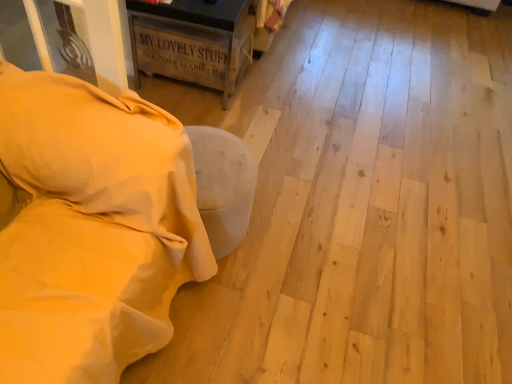
Question: Considering the relative sizes of beige fabric ottoman at lower left, which ranks as the second furniture in top-to-bottom order, and rustic wood crate at upper left, which is the first furniture from top to bottom, in the image provided, is beige fabric ottoman at lower left, which ranks as the second furniture in top-to-bottom order, shorter than rustic wood crate at upper left, which is the first furniture from top to bottom,?

Choices:
 (A) no
 (B) yes

Answer: (A)

Question: From the image's perspective, would you say beige fabric ottoman at lower left, the second furniture when ordered from back to front, is shown under rustic wood crate at upper left, which is counted as the 2th furniture, starting from the front?

Choices:
 (A) no
 (B) yes

Answer: (B)

Question: Is the position of beige fabric ottoman at lower left, positioned as the 1th furniture in bottom-to-top order, more distant than that of rustic wood crate at upper left, which is the first furniture from top to bottom?

Choices:
 (A) no
 (B) yes

Answer: (A)

Question: Does beige fabric ottoman at lower left, positioned as the 1th furniture in bottom-to-top order, appear on the left side of rustic wood crate at upper left, which is counted as the first furniture, starting from the back?

Choices:
 (A) yes
 (B) no

Answer: (A)

Question: From a real-world perspective, does beige fabric ottoman at lower left, the first furniture in the front-to-back sequence, stand above rustic wood crate at upper left, which is counted as the 2th furniture, starting from the front?

Choices:
 (A) yes
 (B) no

Answer: (A)

Question: Considering the positions of beige fabric ottoman at lower left, the second furniture when ordered from back to front, and beige soft pillow at left in the image, is beige fabric ottoman at lower left, the second furniture when ordered from back to front, wider or thinner than beige soft pillow at left?

Choices:
 (A) wide
 (B) thin

Answer: (A)

Question: Is beige fabric ottoman at lower left, positioned as the 1th furniture in bottom-to-top order, situated inside beige soft pillow at left or outside?

Choices:
 (A) outside
 (B) inside

Answer: (A)

Question: From their relative heights in the image, would you say beige fabric ottoman at lower left, which ranks as the second furniture in top-to-bottom order, is taller or shorter than beige soft pillow at left?

Choices:
 (A) tall
 (B) short

Answer: (A)

Question: From a real-world perspective, is beige fabric ottoman at lower left, which ranks as the second furniture in top-to-bottom order, above or below beige soft pillow at left?

Choices:
 (A) above
 (B) below

Answer: (B)

Question: From their relative heights in the image, would you say rustic wood crate at upper left, which is the first furniture from top to bottom, is taller or shorter than beige fabric ottoman at lower left, which ranks as the second furniture in top-to-bottom order?

Choices:
 (A) tall
 (B) short

Answer: (B)

Question: Is rustic wood crate at upper left, which is counted as the first furniture, starting from the back, spatially inside beige fabric ottoman at lower left, which ranks as the second furniture in top-to-bottom order, or outside of it?

Choices:
 (A) outside
 (B) inside

Answer: (A)

Question: From a real-world perspective, relative to beige fabric ottoman at lower left, positioned as the 1th furniture in bottom-to-top order, is rustic wood crate at upper left, which is the first furniture from top to bottom, vertically above or below?

Choices:
 (A) above
 (B) below

Answer: (B)

Question: Based on their sizes in the image, would you say rustic wood crate at upper left, which is the 2th furniture from bottom to top, is bigger or smaller than beige fabric ottoman at lower left, the first furniture in the front-to-back sequence?

Choices:
 (A) big
 (B) small

Answer: (B)

Question: In terms of size, does beige soft pillow at left appear bigger or smaller than beige fabric ottoman at lower left, the second furniture when ordered from back to front?

Choices:
 (A) big
 (B) small

Answer: (B)

Question: From the image's perspective, relative to beige fabric ottoman at lower left, positioned as the 1th furniture in bottom-to-top order, is beige soft pillow at left above or below?

Choices:
 (A) below
 (B) above

Answer: (B)